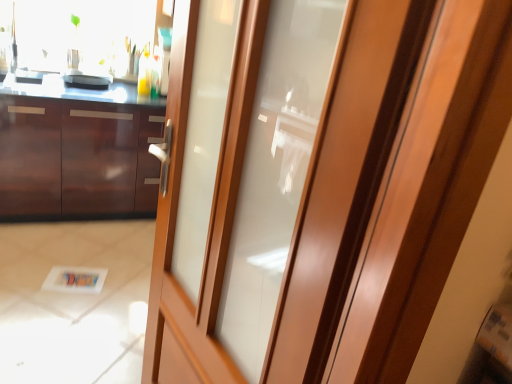
Question: Visually, is matte black pan at upper left positioned to the left or to the right of glossy wood cabinetry at left?

Choices:
 (A) left
 (B) right

Answer: (A)

Question: Is point (70, 69) positioned closer to the camera than point (20, 107)?

Choices:
 (A) farther
 (B) closer

Answer: (A)

Question: Which of these objects is positioned closest to the matte wood door at center?

Choices:
 (A) matte black pan at upper left
 (B) glossy wood cabinetry at left

Answer: (B)

Question: Which of these objects is positioned closest to the matte wood door at center?

Choices:
 (A) glossy wood cabinetry at left
 (B) matte black pan at upper left

Answer: (A)